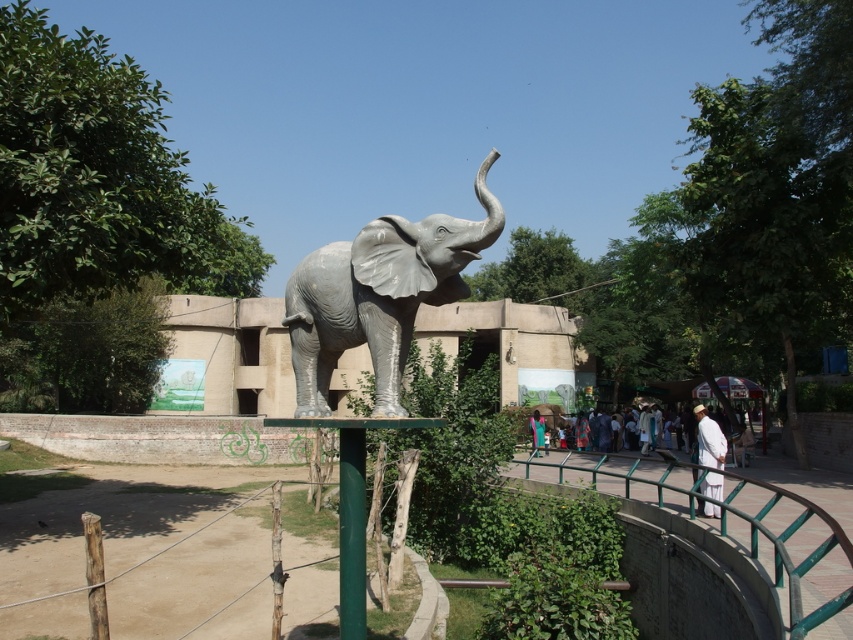
Question: Which is nearer to the light blue fabric at center?

Choices:
 (A) green metal railing at lower right
 (B) green painted metal pole at lower center

Answer: (A)

Question: Where is green metal railing at lower right located in relation to light blue fabric at center in the image?

Choices:
 (A) left
 (B) right

Answer: (B)

Question: Does green painted metal pole at lower center appear under light blue fabric at center?

Choices:
 (A) yes
 (B) no

Answer: (B)

Question: Estimate the real-world distances between objects in this image. Which object is closer to the light blue fabric at center?

Choices:
 (A) green metal railing at lower right
 (B) sanded gray elephant at center
 (C) white cotton clothing at lower right

Answer: (A)

Question: Which is nearer to the sanded gray elephant at center?

Choices:
 (A) white cotton clothing at lower right
 (B) green painted metal pole at lower center

Answer: (B)

Question: Is green metal railing at lower right to the left of green painted metal pole at lower center from the viewer's perspective?

Choices:
 (A) no
 (B) yes

Answer: (A)